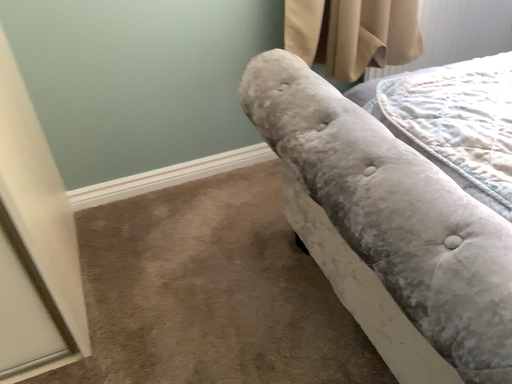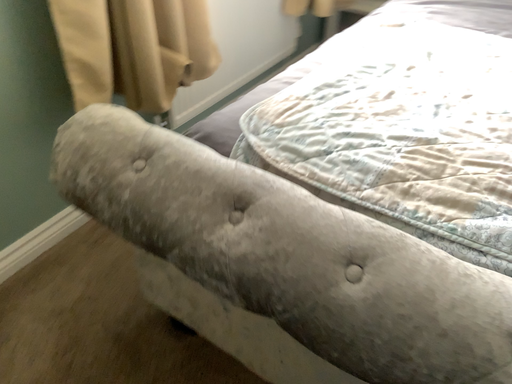
Question: Which way did the camera rotate in the video?

Choices:
 (A) rotated right
 (B) rotated left

Answer: (A)